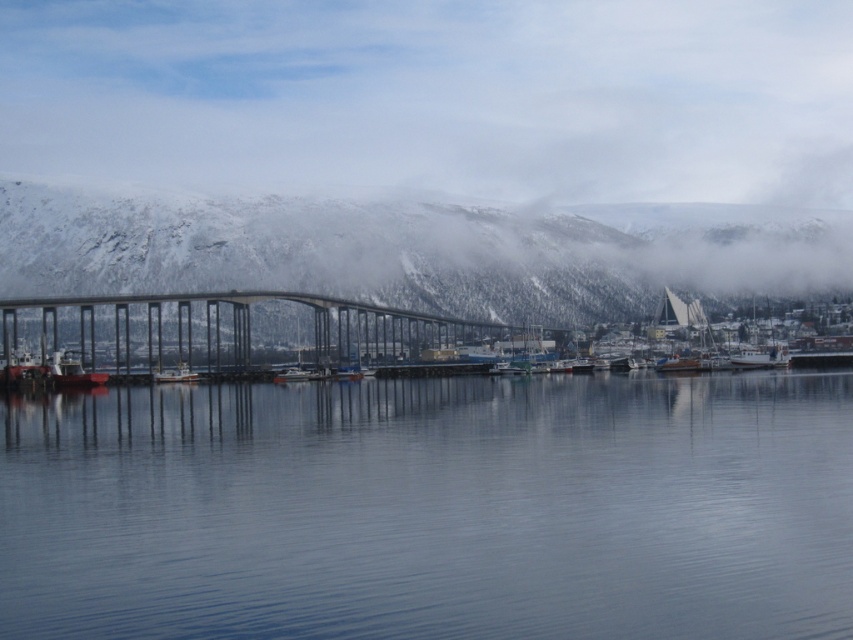
You are standing on the shore and see the smooth blue water at center and the metallic silver boat at center. Which object is positioned to the right of the other?

The smooth blue water at center is to the right of the metallic silver boat at center.

You are standing at point (187,342) and want to walk to point (323,291). Based on the scene description, will you have to go around any obstacles or can you walk directly towards your destination?

Since point (323,291) is behind point (187,342), you can walk directly towards it without needing to go around any obstacles.

Based on the photo, you are standing on the shore and want to take a photo of the smooth blue water at center and the metallic silver boat at center. Which object will appear closer to the camera in the photo?

The smooth blue water at center will appear closer to the camera in the photo because it is positioned in front of the metallic silver boat at center.